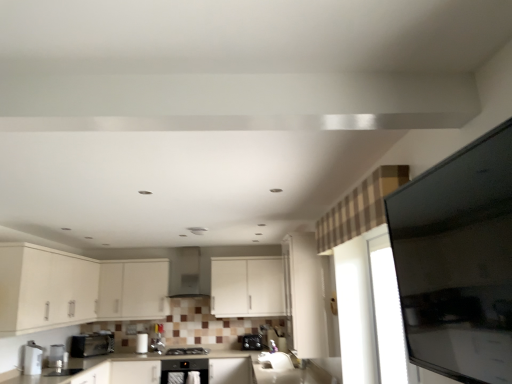
Question: Is matte white cabinet at center, which is the second cabinetry from left to right, positioned with its back to matte white cabinets at lower left, acting as the first cabinetry starting from the left?

Choices:
 (A) no
 (B) yes

Answer: (B)

Question: Is matte white cabinet at center, which is the second cabinetry from left to right, not inside matte white cabinets at lower left, acting as the first cabinetry starting from the left?

Choices:
 (A) no
 (B) yes

Answer: (A)

Question: From the image's perspective, is matte white cabinet at center, the second cabinetry viewed from the right, on top of matte white cabinets at lower left, the third cabinetry when ordered from right to left?

Choices:
 (A) no
 (B) yes

Answer: (A)

Question: Considering the relative sizes of matte white cabinet at center, which is the second cabinetry from left to right, and matte white cabinets at lower left, the third cabinetry when ordered from right to left, in the image provided, is matte white cabinet at center, which is the second cabinetry from left to right, taller than matte white cabinets at lower left, the third cabinetry when ordered from right to left,?

Choices:
 (A) yes
 (B) no

Answer: (B)

Question: Can you confirm if matte white cabinet at center, which is the second cabinetry from left to right, is thinner than matte white cabinets at lower left, acting as the first cabinetry starting from the left?

Choices:
 (A) yes
 (B) no

Answer: (A)

Question: From a real-world perspective, is matte white cabinet at center, which is the second cabinetry from left to right, over matte white cabinets at lower left, the third cabinetry when ordered from right to left?

Choices:
 (A) yes
 (B) no

Answer: (B)

Question: Would you say satin silver toaster at center, the fifth appliance from the left, is a long distance from satin silver faucet at lower left, the fifth appliance positioned from the right?

Choices:
 (A) no
 (B) yes

Answer: (B)

Question: Can you confirm if satin silver toaster at center, acting as the fifth appliance starting from the front, is shorter than satin silver faucet at lower left, the fifth appliance positioned from the right?

Choices:
 (A) yes
 (B) no

Answer: (A)

Question: Is satin silver toaster at center, which is the 1th appliance in right-to-left order, positioned before satin silver faucet at lower left, the first appliance when ordered from front to back?

Choices:
 (A) no
 (B) yes

Answer: (A)

Question: Is satin silver toaster at center, the fifth appliance from the left, not within satin silver faucet at lower left, the first appliance in the left-to-right sequence?

Choices:
 (A) no
 (B) yes

Answer: (B)

Question: Can satin silver faucet at lower left, the fifth appliance positioned from the right, be found inside satin silver toaster at center, the fifth appliance from the left?

Choices:
 (A) yes
 (B) no

Answer: (B)

Question: Is satin silver toaster at center, acting as the fifth appliance starting from the front, next to satin silver faucet at lower left, the first appliance in the left-to-right sequence, and touching it?

Choices:
 (A) yes
 (B) no

Answer: (B)

Question: Is satin black oven at center, which is the first home appliance in bottom-to-top order, to the left of metallic silver toaster at lower left, marked as the 2th appliance in a front-to-back arrangement, from the viewer's perspective?

Choices:
 (A) no
 (B) yes

Answer: (A)